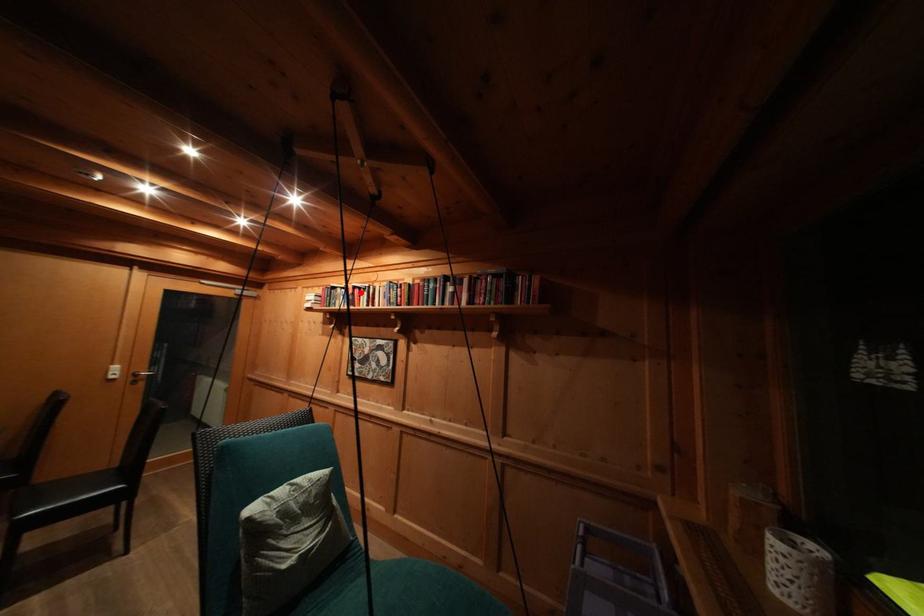
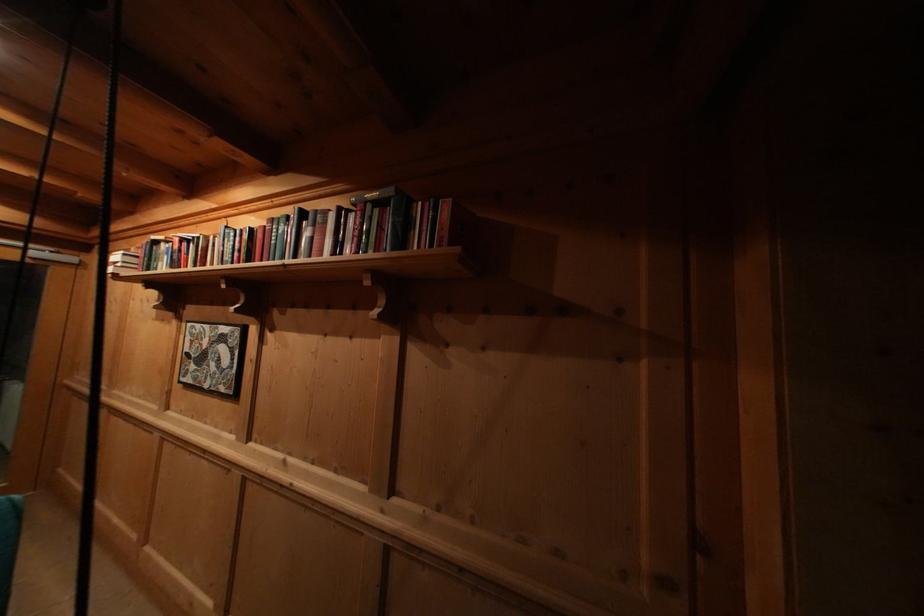
Question: I am providing you with two images of the same scene from different viewpoints. A red point is marked on the first image. Can you still see the location of the red point in image 2?

Choices:
 (A) Yes
 (B) No

Answer: (A)